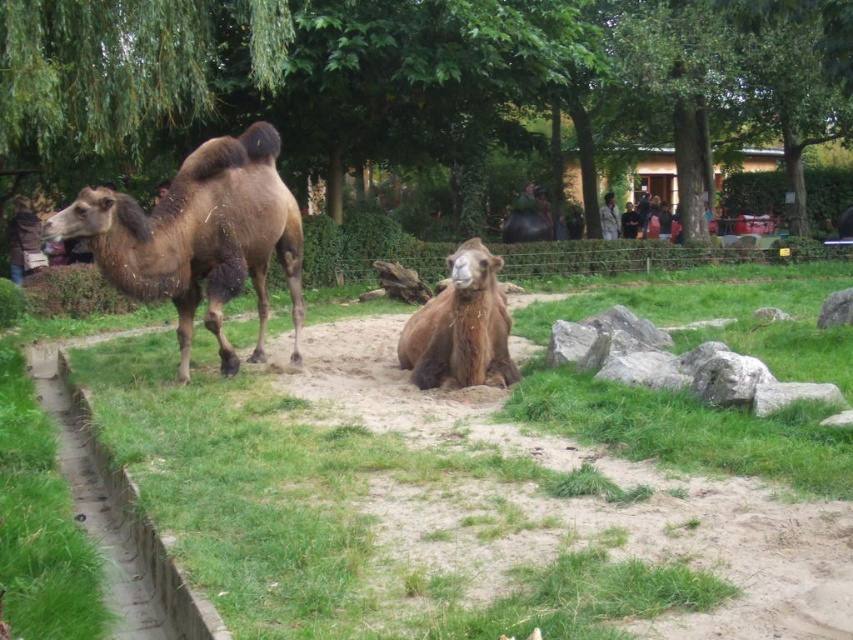
What do you see at coordinates (408, 77) in the screenshot?
I see `green leafy tree at upper center` at bounding box center [408, 77].

Does green leafy tree at upper center have a lesser width compared to brown fuzzy camel at left?

No, green leafy tree at upper center is not thinner than brown fuzzy camel at left.

Locate an element on the screen. Image resolution: width=853 pixels, height=640 pixels. green leafy tree at upper center is located at coordinates (408, 77).

At what (x,y) coordinates should I click in order to perform the action: click on green leafy tree at upper center. Please return your answer as a coordinate pair (x, y). This screenshot has height=640, width=853. Looking at the image, I should click on (408, 77).

Who is more forward, (318, 337) or (837, 321)?

Positioned in front is point (837, 321).

Can you confirm if green grass at lower left is positioned to the right of gray rough rock at lower right?

In fact, green grass at lower left is to the left of gray rough rock at lower right.

Where is `green grass at lower left`? This screenshot has width=853, height=640. green grass at lower left is located at coordinates (456, 499).

Does brown fuzzy camel at left have a lesser height compared to gray rough rock at lower right?

Incorrect, brown fuzzy camel at left's height does not fall short of gray rough rock at lower right's.

Is brown fuzzy camel at left wider than gray rough rock at lower right?

Yes.

What do you see at coordinates (199, 237) in the screenshot? I see `brown fuzzy camel at left` at bounding box center [199, 237].

This screenshot has height=640, width=853. Find the location of `brown fuzzy camel at left`. brown fuzzy camel at left is located at coordinates (199, 237).